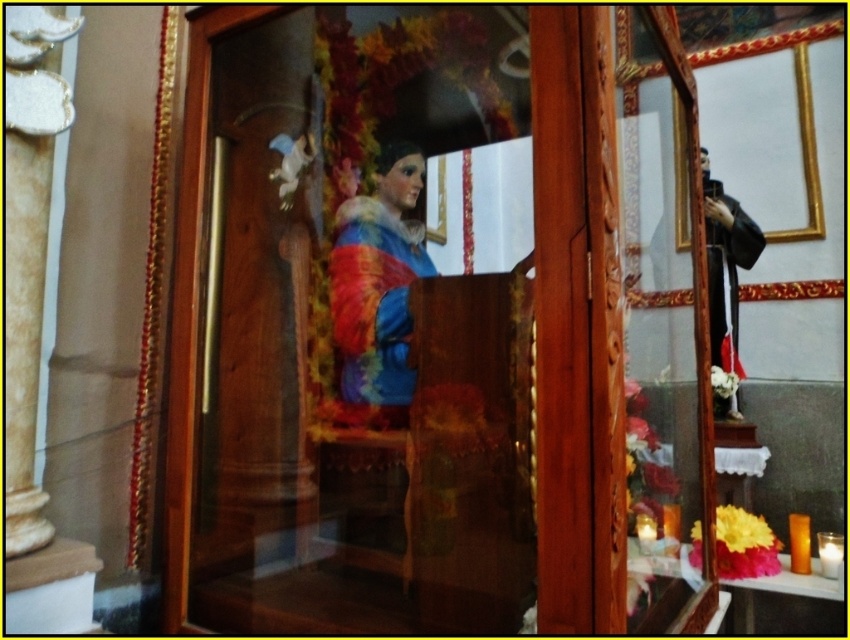
Question: Based on their relative distances, which object is farther from the matte painted statue at center?

Choices:
 (A) transparent glass statue at center
 (B) black matte robe at right

Answer: (B)

Question: Is matte painted statue at center below black matte robe at right?

Choices:
 (A) no
 (B) yes

Answer: (B)

Question: Does matte painted statue at center have a larger size compared to black matte robe at right?

Choices:
 (A) no
 (B) yes

Answer: (B)

Question: Which of the following is the closest to the observer?

Choices:
 (A) (361, 236)
 (B) (744, 378)
 (C) (231, 486)

Answer: (C)

Question: Can you confirm if transparent glass statue at center is smaller than black matte robe at right?

Choices:
 (A) yes
 (B) no

Answer: (B)

Question: Based on their relative distances, which object is nearer to the matte painted statue at center?

Choices:
 (A) black matte robe at right
 (B) transparent glass statue at center

Answer: (B)